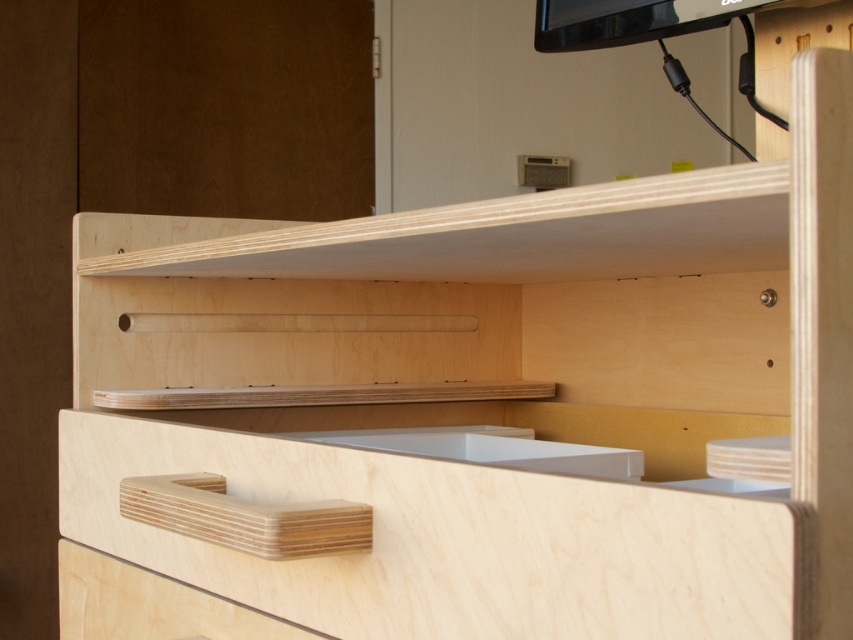
Measure the distance between point [62,582] and camera.

Result: The distance of point [62,582] from camera is 37.87 inches.

Between light wood drawer at lower left and white matte sink at center, which one appears on the left side from the viewer's perspective?

light wood drawer at lower left

This screenshot has height=640, width=853. Find the location of `light wood drawer at lower left`. light wood drawer at lower left is located at coordinates (149, 604).

Consider the image. Can you confirm if natural wood drawer at lower center is taller than white matte sink at center?

Correct, natural wood drawer at lower center is much taller as white matte sink at center.

Is natural wood drawer at lower center smaller than white matte sink at center?

Actually, natural wood drawer at lower center might be larger than white matte sink at center.

Who is more forward, (x=341, y=465) or (x=523, y=440)?

Positioned in front is point (x=341, y=465).

Locate an element on the screen. natural wood drawer at lower center is located at coordinates (445, 541).

Measure the distance from natural wood drawer at lower center to light wood drawer at lower left.

natural wood drawer at lower center and light wood drawer at lower left are 7.69 centimeters apart from each other.

Based on the photo, which is more to the right, natural wood drawer at lower center or light wood drawer at lower left?

natural wood drawer at lower center is more to the right.

Between point (341, 620) and point (132, 616), which one is positioned behind?

The point (132, 616) is behind.

Find the location of a particular element. The height and width of the screenshot is (640, 853). natural wood drawer at lower center is located at coordinates (445, 541).